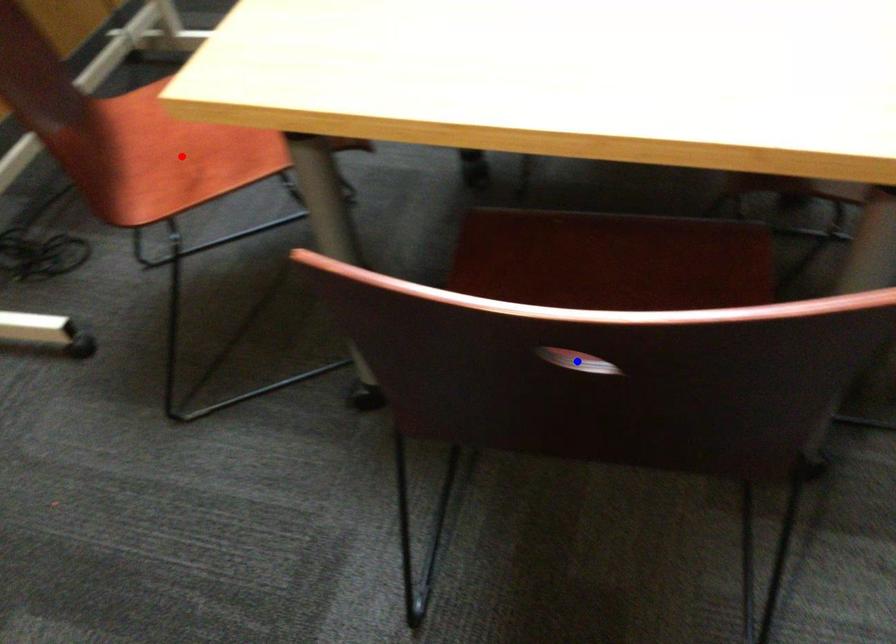
Question: Which of the two points in the image is closer to the camera?

Choices:
 (A) Blue point is closer.
 (B) Red point is closer.

Answer: (A)